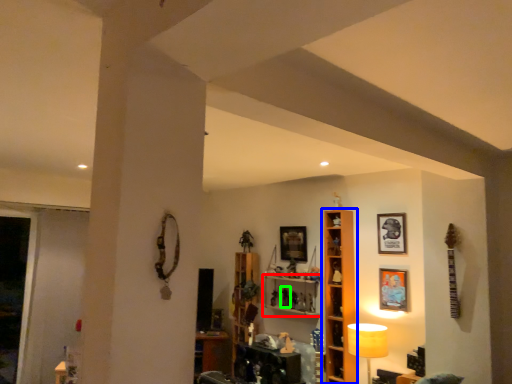
Question: Considering the real-world distances, which object is farthest from shelf (highlighted by a red box)? shelf (highlighted by a blue box) or toy (highlighted by a green box)?

Choices:
 (A) shelf
 (B) toy

Answer: (A)